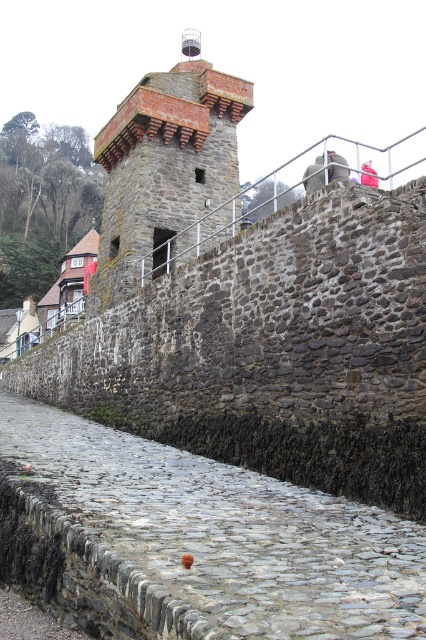
Is point (229, 484) more distant than point (195, 216)?

No, (229, 484) is in front of (195, 216).

The height and width of the screenshot is (640, 426). I want to click on cobblestone at lower center, so click(230, 531).